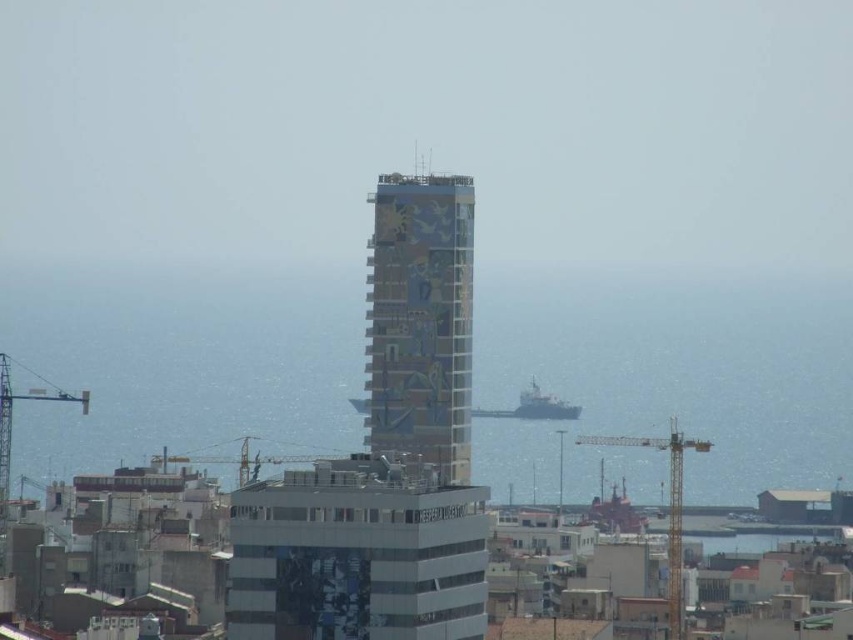
Question: Does transparent glass water at center have a smaller size compared to white glass building at center?

Choices:
 (A) yes
 (B) no

Answer: (B)

Question: Which object appears closest to the camera in this image?

Choices:
 (A) yellow metallic crane at lower center
 (B) yellow metallic crane at lower right

Answer: (A)

Question: Does white glass building at center appear under yellow metallic crane at lower center?

Choices:
 (A) yes
 (B) no

Answer: (A)

Question: Which point is farther to the camera?

Choices:
 (A) (206, 458)
 (B) (589, 465)

Answer: (A)

Question: Which of these objects is positioned farthest from the multicolored mosaic tower at center?

Choices:
 (A) yellow metallic crane at lower center
 (B) transparent glass water at center
 (C) white glass building at center

Answer: (A)

Question: From the image, what is the correct spatial relationship of yellow metallic crane at lower right in relation to white matte ship at center?

Choices:
 (A) right
 (B) left

Answer: (A)